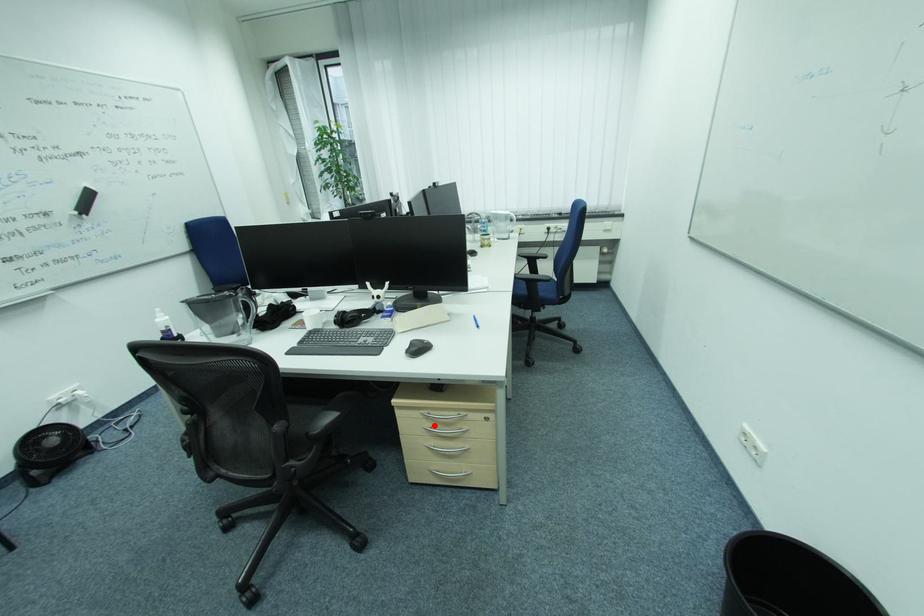
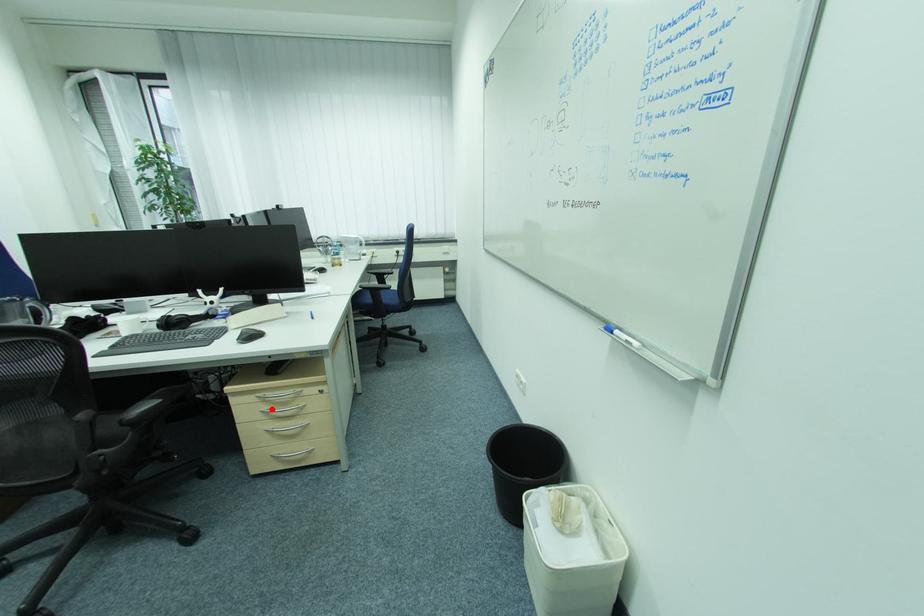
I am providing you with two images of the same scene from different viewpoints. A red point is marked on the first image and another point is marked on the second image. Is the red point in image1 aligned with the point shown in image2?

Yes